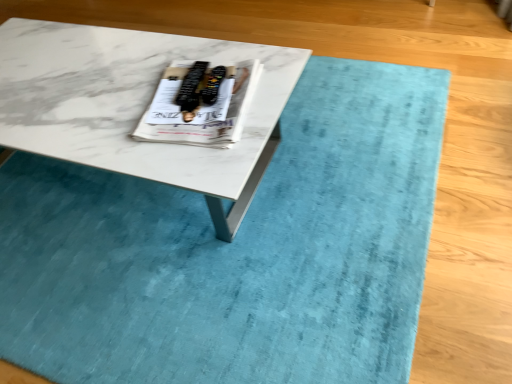
This screenshot has height=384, width=512. Find the location of `vacant point to the left of white glossy magazine at center`. vacant point to the left of white glossy magazine at center is located at coordinates (96, 107).